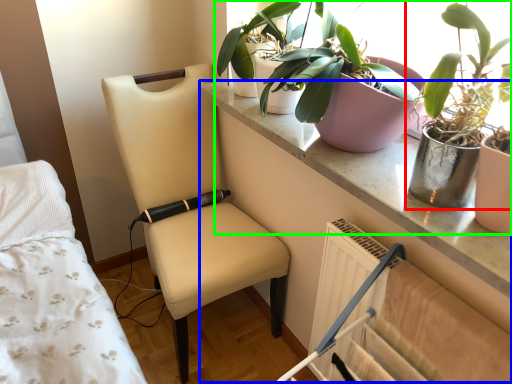
Question: Estimate the real-world distances between objects in this image. Which object is closer to houseplant (highlighted by a red box), table (highlighted by a blue box) or houseplant (highlighted by a green box)?

Choices:
 (A) table
 (B) houseplant

Answer: (B)